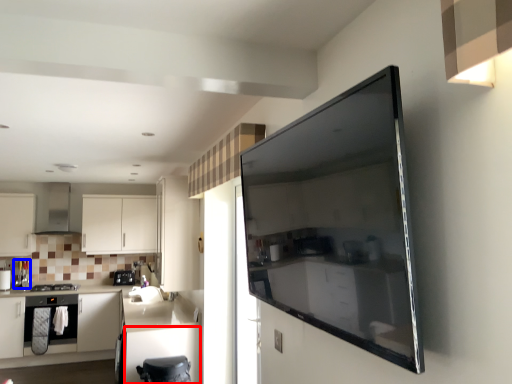
Question: Which object is further to the camera taking this photo, cabinetry (highlighted by a red box) or appliance (highlighted by a blue box)?

Choices:
 (A) cabinetry
 (B) appliance

Answer: (B)